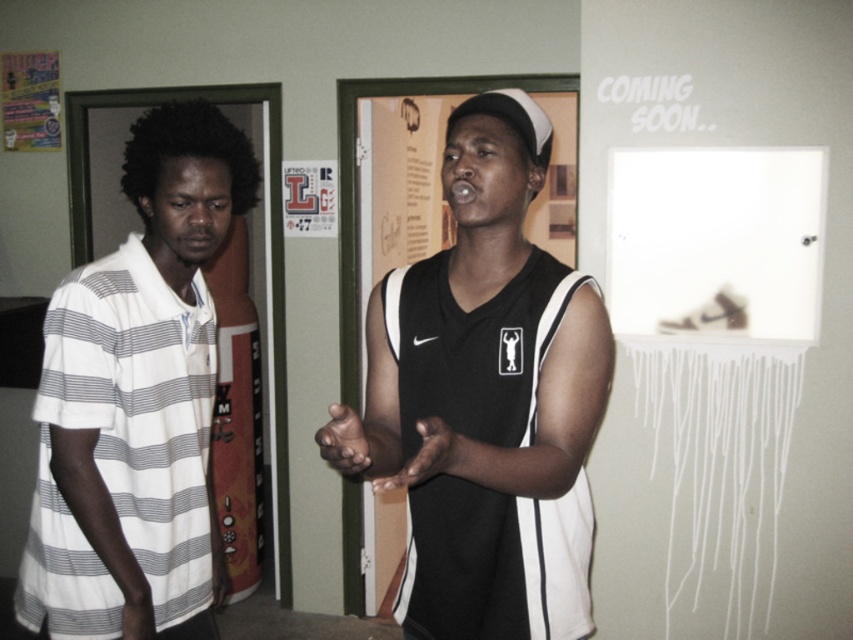
Question: Can you confirm if black matte basketball jersey at center is positioned below smooth skin hand at lower left?

Choices:
 (A) no
 (B) yes

Answer: (A)

Question: Can you confirm if smooth skin hand at center is smaller than dark skin hand at center?

Choices:
 (A) no
 (B) yes

Answer: (A)

Question: Observing the image, what is the correct spatial positioning of smooth skin hand at center in reference to smooth skin hand at lower left?

Choices:
 (A) right
 (B) left

Answer: (A)

Question: Which point is farther from the camera taking this photo?

Choices:
 (A) (331, 417)
 (B) (200, 278)
 (C) (431, 474)

Answer: (B)

Question: Which of the following is the farthest from the observer?

Choices:
 (A) (438, 429)
 (B) (120, 621)
 (C) (99, 634)
 (D) (583, 310)

Answer: (C)

Question: Which of the following is the farthest from the observer?

Choices:
 (A) black matte basketball jersey at center
 (B) smooth skin hand at center
 (C) dark skin hand at center

Answer: (A)